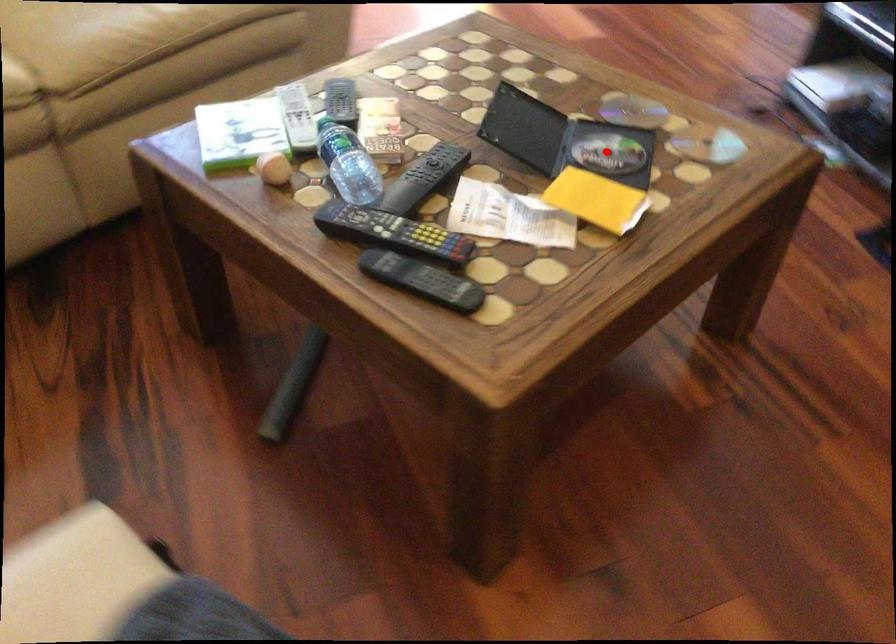
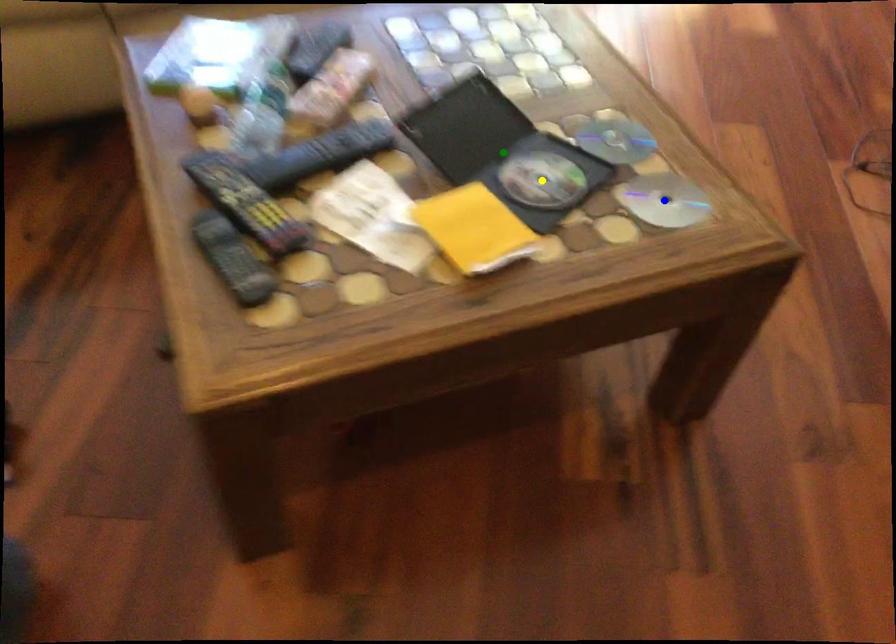
Question: I am providing you with two images of the same scene from different viewpoints. A red point is marked on the first image. You are given multiple points on the second image. In image 2, which mark is for the same physical point as the one in image 1?

Choices:
 (A) yellow point
 (B) blue point
 (C) green point

Answer: (A)